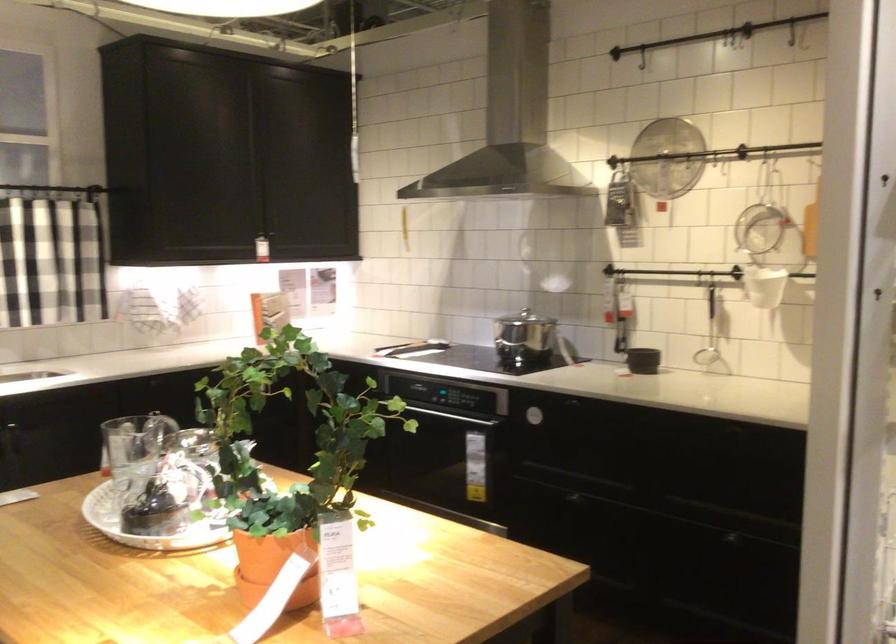
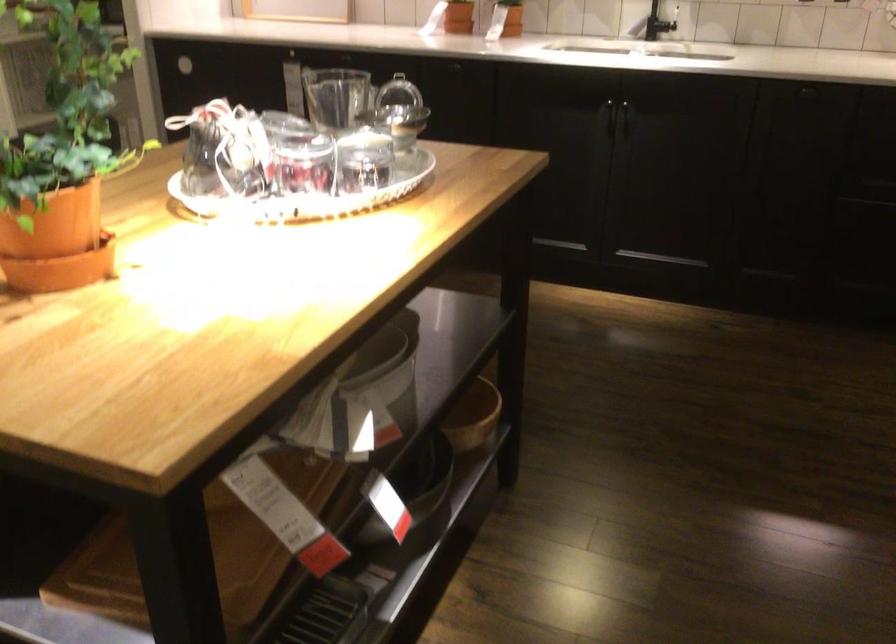
Find the pixel in the second image that matches [116,446] in the first image.

(334, 96)